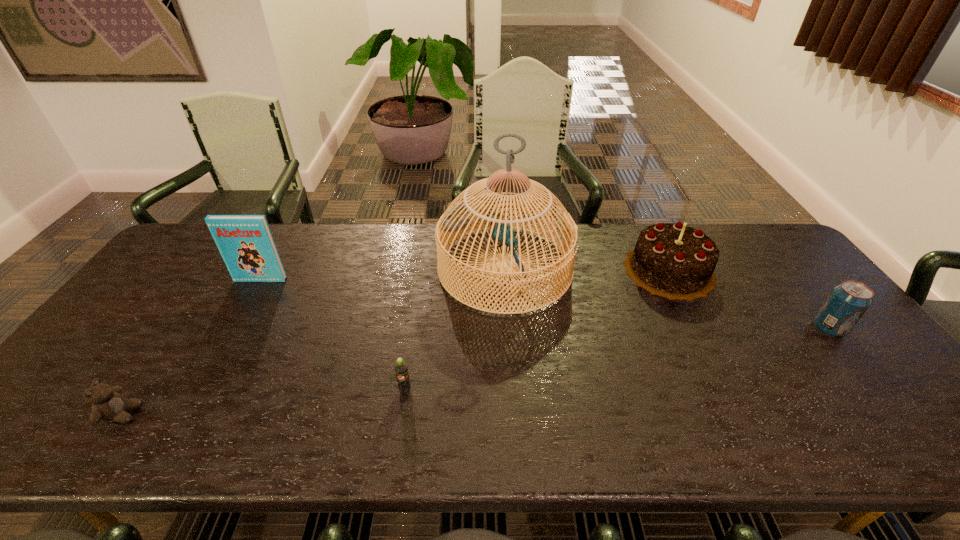
Find the location of `the leftmost object`. the leftmost object is located at coordinates (108, 404).

This screenshot has height=540, width=960. What are the coordinates of `teddy bear` in the screenshot? It's located at (108, 404).

In order to click on free space located 0.100m on the right of the fourth object from left to right in this screenshot , I will do `click(604, 268)`.

Locate an element on the screen. This screenshot has width=960, height=540. vacant position located 0.220m on the front cover of the second tallest object is located at coordinates (228, 338).

Where is `vacant region located 0.230m on the left of the second object from right to left`? The width and height of the screenshot is (960, 540). vacant region located 0.230m on the left of the second object from right to left is located at coordinates (551, 270).

Locate an element on the screen. This screenshot has width=960, height=540. vacant area located on the back of the third shortest object is located at coordinates (782, 271).

Locate an element on the screen. The height and width of the screenshot is (540, 960). free location located on the front label of the fourth object from right to left is located at coordinates (401, 414).

The image size is (960, 540). Find the location of `free space located 0.080m on the face of the nearest object`. free space located 0.080m on the face of the nearest object is located at coordinates (175, 414).

I want to click on birdcage that is positioned at the far edge, so click(455, 218).

This screenshot has height=540, width=960. In order to click on birthday cake that is at the far edge in this screenshot , I will do `click(675, 261)`.